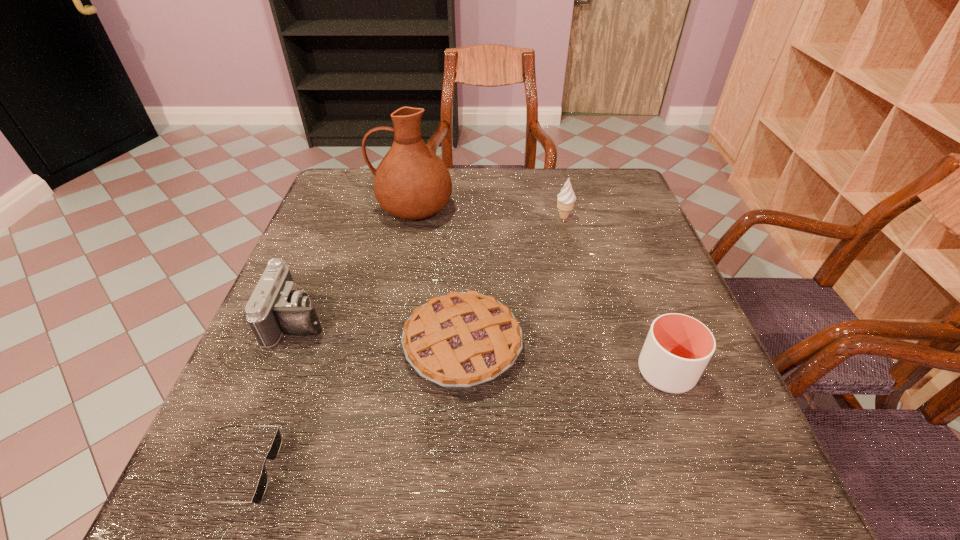
Identify the location of vacant space located 0.250m on the front-facing side of the icecream. (581, 290).

Locate an element on the screen. vacant space positioned 0.360m at the front of the camera with an open lens cover is located at coordinates (504, 319).

Where is `vacant area situated 0.370m on the left of the cup`? The height and width of the screenshot is (540, 960). vacant area situated 0.370m on the left of the cup is located at coordinates (437, 372).

Image resolution: width=960 pixels, height=540 pixels. Find the location of `free space located on the left of the pie`. free space located on the left of the pie is located at coordinates (316, 346).

This screenshot has height=540, width=960. Find the location of `vacant space located 0.330m on the front-facing side of the shortest object`. vacant space located 0.330m on the front-facing side of the shortest object is located at coordinates (487, 470).

Image resolution: width=960 pixels, height=540 pixels. What are the coordinates of `pitcher that is positioned at the far edge` in the screenshot? It's located at (411, 182).

Locate an element on the screen. This screenshot has height=540, width=960. icecream present at the far edge is located at coordinates (566, 198).

You are a GUI agent. You are given a task and a screenshot of the screen. Output one action in this format:
    pyautogui.click(x=<x>, y=<y>)
    Task: Click on the object located in the near edge section of the desktop
    
    Given the screenshot: What is the action you would take?
    pyautogui.click(x=276, y=444)

Where is `pitcher located in the left edge section of the desktop`? pitcher located in the left edge section of the desktop is located at coordinates (411, 182).

What are the coordinates of `camera that is at the left edge` in the screenshot? It's located at (276, 306).